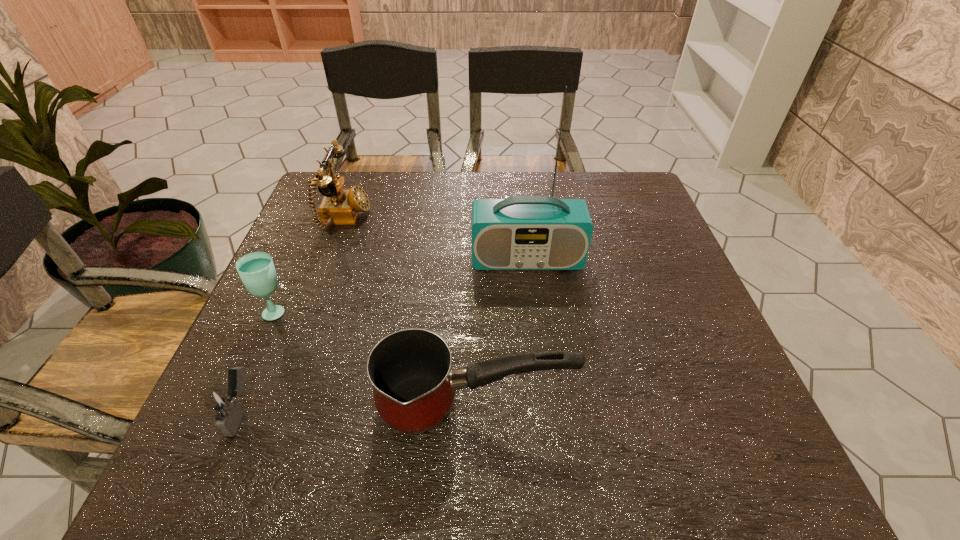
The image size is (960, 540). I want to click on the tallest object, so click(x=522, y=232).

Image resolution: width=960 pixels, height=540 pixels. Identify the location of the fourth shortest object. (339, 206).

I want to click on saucepan, so click(414, 386).

Find the location of `the third nearest object`. the third nearest object is located at coordinates (256, 270).

Image resolution: width=960 pixels, height=540 pixels. Identify the location of the shortest object. (222, 405).

Identify the location of blank area located on the front panel of the radio receiver. (540, 372).

The image size is (960, 540). Identify the location of free spot located 0.250m on the dial number of the telephone. click(461, 219).

Identify the location of free location located on the handle side of the saucepan. Image resolution: width=960 pixels, height=540 pixels. (678, 406).

Image resolution: width=960 pixels, height=540 pixels. Find the location of `vacant space located 0.080m on the right of the glass`. vacant space located 0.080m on the right of the glass is located at coordinates (328, 310).

The image size is (960, 540). In order to click on free space located on the right of the shortest object in this screenshot , I will do point(352,411).